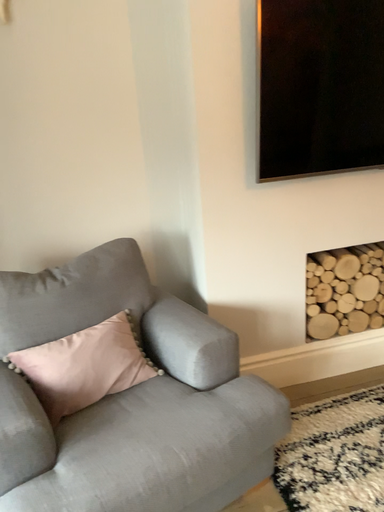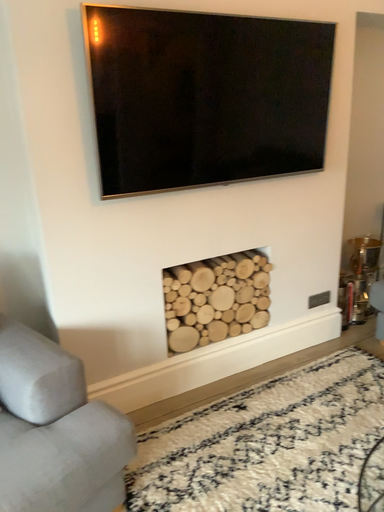
Question: How did the camera likely rotate when shooting the video?

Choices:
 (A) rotated left
 (B) rotated right

Answer: (B)